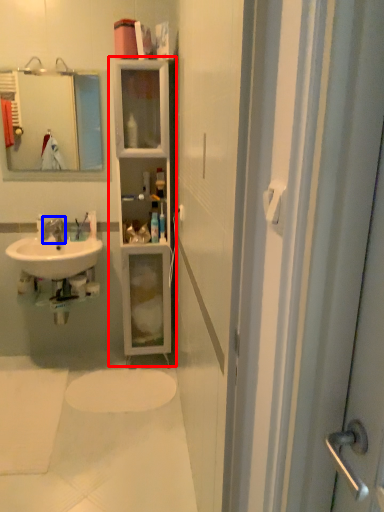
Question: Which object is further to the camera taking this photo, bathroom cabinet (highlighted by a red box) or tap (highlighted by a blue box)?

Choices:
 (A) bathroom cabinet
 (B) tap

Answer: (B)